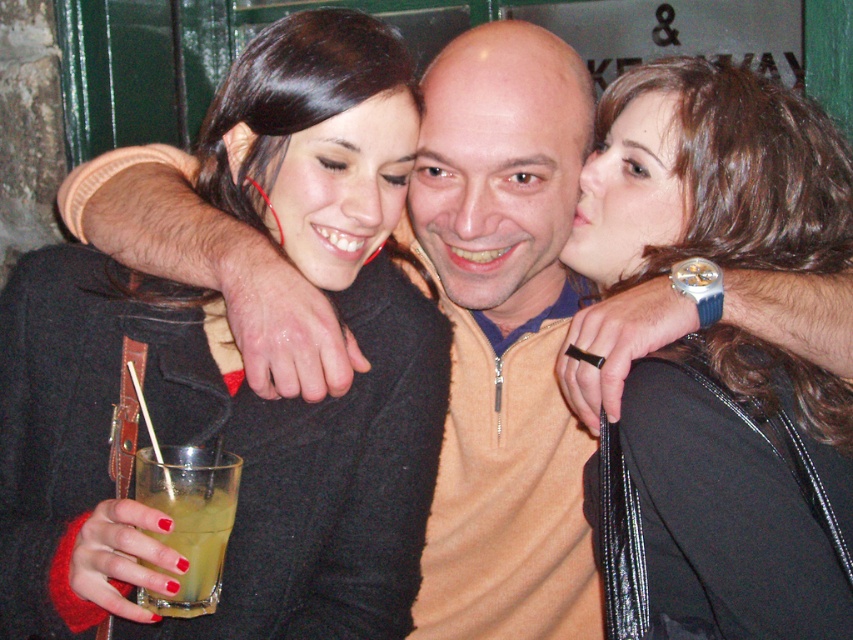
Question: Among these points, which one is nearest to the camera?

Choices:
 (A) (521, 154)
 (B) (363, 154)
 (C) (199, 586)

Answer: (C)

Question: Which of these objects is positioned farthest from the matte black face at center?

Choices:
 (A) yellow translucent glass at lower left
 (B) smooth skin face at upper right

Answer: (A)

Question: Is smooth skin face at upper right to the left of yellow translucent glass at lower left from the viewer's perspective?

Choices:
 (A) no
 (B) yes

Answer: (A)

Question: Is matte black jacket at center to the left of matte black face at center from the viewer's perspective?

Choices:
 (A) no
 (B) yes

Answer: (A)

Question: Among these points, which one is farthest from the camera?

Choices:
 (A) (550, 83)
 (B) (306, 211)

Answer: (A)

Question: Does smooth skin face at upper right come in front of yellow translucent glass at lower left?

Choices:
 (A) yes
 (B) no

Answer: (B)